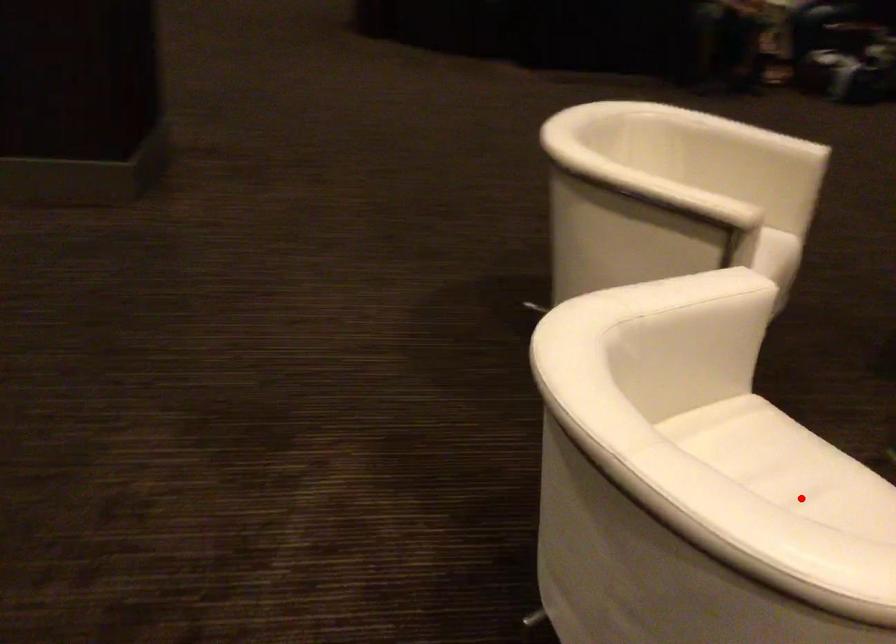
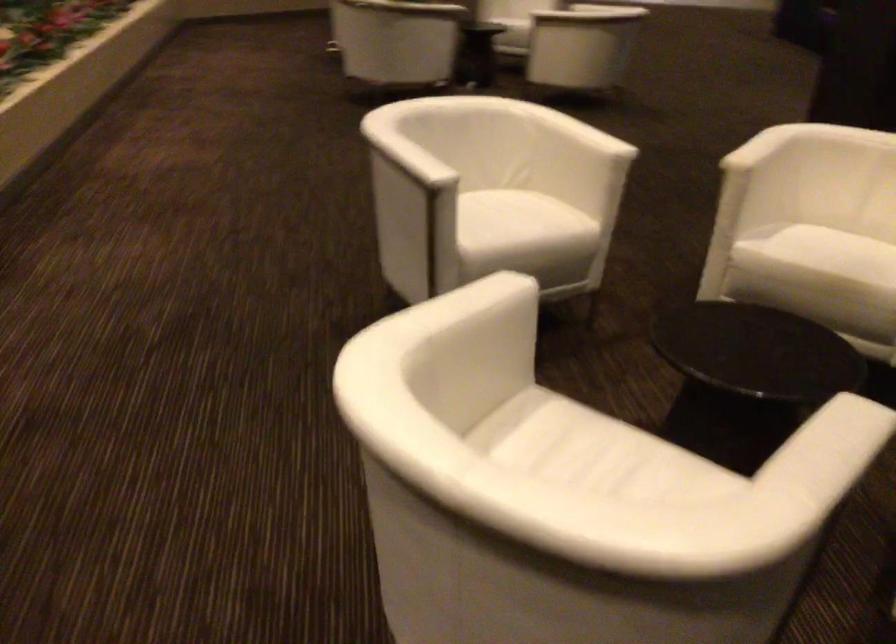
Question: A red point is marked in image1. In image2, is the corresponding 3D point closer to the camera or farther? Reply with the corresponding letter.

Choices:
 (A) The corresponding 3D point is closer.
 (B) The corresponding 3D point is farther.

Answer: (B)